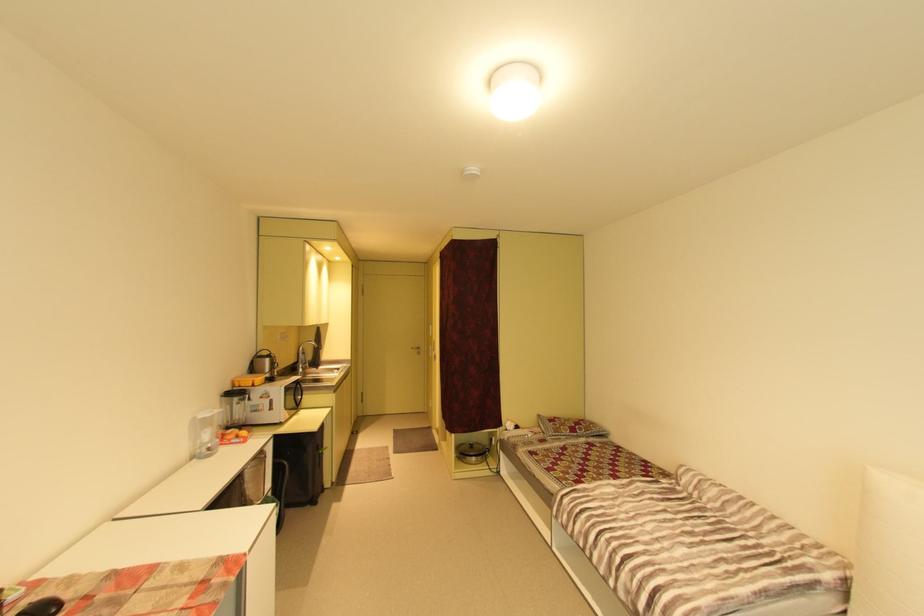
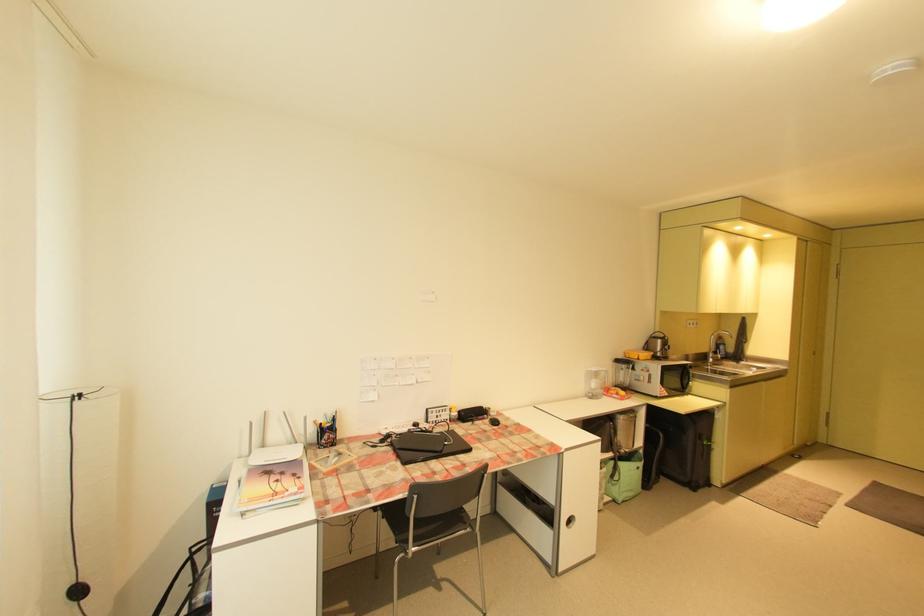
Locate, in the second image, the point that corresponds to (310,362) in the first image.

(722, 353)